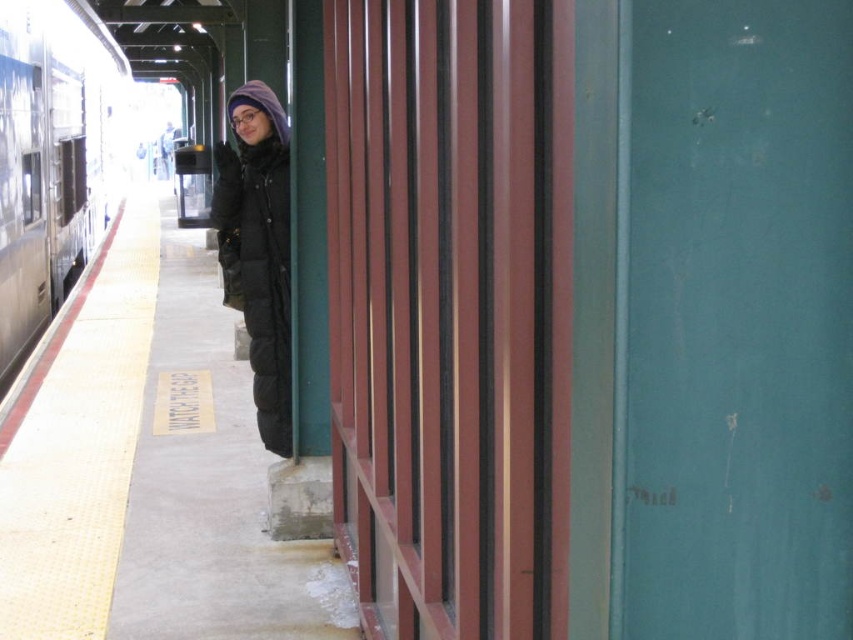
Between point (33, 464) and point (219, 216), which one is positioned behind?

Positioned behind is point (33, 464).

Which is in front, point (171, 433) or point (244, 195)?

Positioned in front is point (244, 195).

This screenshot has width=853, height=640. In order to click on concrete platform at lower left in this screenshot , I will do `click(152, 470)`.

Locate an element on the screen. The image size is (853, 640). concrete platform at lower left is located at coordinates (152, 470).

Is point (138, 460) positioned behind point (57, 22)?

No, it is not.

Consider the image. Can you confirm if concrete platform at lower left is bigger than silver metallic train at left?

No.

Locate an element on the screen. The width and height of the screenshot is (853, 640). concrete platform at lower left is located at coordinates (152, 470).

Between point (117, 147) and point (279, 259), which one is positioned behind?

Positioned behind is point (117, 147).

Which is below, silver metallic train at left or matte black coat at center?

matte black coat at center is lower down.

Who is more forward, (19, 221) or (282, 387)?

Point (282, 387)

Where is `silver metallic train at left`? silver metallic train at left is located at coordinates (51, 157).